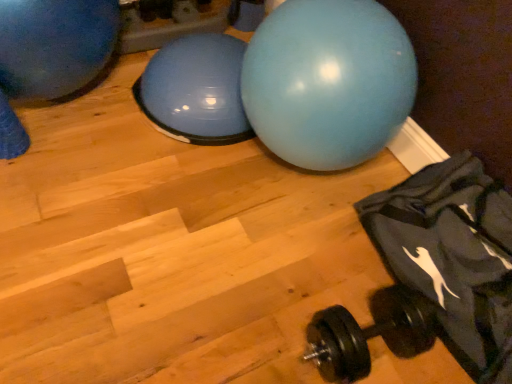
Question: Is matte blue ball at center, which is counted as the 1th ball, starting from the right, turned away from black rubber dumbbell at lower right?

Choices:
 (A) no
 (B) yes

Answer: (A)

Question: From the image's perspective, would you say matte blue ball at center, the 2th ball from the left, is positioned over black rubber dumbbell at lower right?

Choices:
 (A) yes
 (B) no

Answer: (A)

Question: Considering the relative positions of matte blue ball at center, which is counted as the 1th ball, starting from the right, and black rubber dumbbell at lower right in the image provided, is matte blue ball at center, which is counted as the 1th ball, starting from the right, to the right of black rubber dumbbell at lower right from the viewer's perspective?

Choices:
 (A) no
 (B) yes

Answer: (A)

Question: Does matte blue ball at center, which is counted as the 1th ball, starting from the right, turn towards black rubber dumbbell at lower right?

Choices:
 (A) no
 (B) yes

Answer: (A)

Question: Considering the relative sizes of matte blue ball at center, the 2th ball from the left, and black rubber dumbbell at lower right in the image provided, is matte blue ball at center, the 2th ball from the left, taller than black rubber dumbbell at lower right?

Choices:
 (A) no
 (B) yes

Answer: (B)

Question: From a real-world perspective, relative to black rubber dumbbell at lower right, is dark gray fabric bean bag chair at lower right vertically above or below?

Choices:
 (A) above
 (B) below

Answer: (A)

Question: From the image's perspective, relative to black rubber dumbbell at lower right, is dark gray fabric bean bag chair at lower right above or below?

Choices:
 (A) below
 (B) above

Answer: (B)

Question: Is dark gray fabric bean bag chair at lower right wider or thinner than black rubber dumbbell at lower right?

Choices:
 (A) wide
 (B) thin

Answer: (A)

Question: Is dark gray fabric bean bag chair at lower right taller or shorter than black rubber dumbbell at lower right?

Choices:
 (A) tall
 (B) short

Answer: (A)

Question: In terms of size, does blue rubber ball at upper left, the 2th ball from the right, appear bigger or smaller than matte blue ball at center, the 2th ball from the left?

Choices:
 (A) small
 (B) big

Answer: (A)

Question: Is point (18, 62) positioned closer to the camera than point (264, 104)?

Choices:
 (A) farther
 (B) closer

Answer: (A)

Question: Looking at their shapes, would you say blue rubber ball at upper left, placed as the first ball when sorted from left to right, is wider or thinner than matte blue ball at center, which is counted as the 1th ball, starting from the right?

Choices:
 (A) wide
 (B) thin

Answer: (A)

Question: Considering their positions, is blue rubber ball at upper left, placed as the first ball when sorted from left to right, located in front of or behind matte blue ball at center, the 2th ball from the left?

Choices:
 (A) behind
 (B) front

Answer: (A)

Question: Considering their positions, is dark gray fabric bean bag chair at lower right located in front of or behind blue rubber ball at upper left, the 2th ball from the right?

Choices:
 (A) front
 (B) behind

Answer: (A)

Question: From a real-world perspective, is dark gray fabric bean bag chair at lower right above or below blue rubber ball at upper left, placed as the first ball when sorted from left to right?

Choices:
 (A) below
 (B) above

Answer: (A)